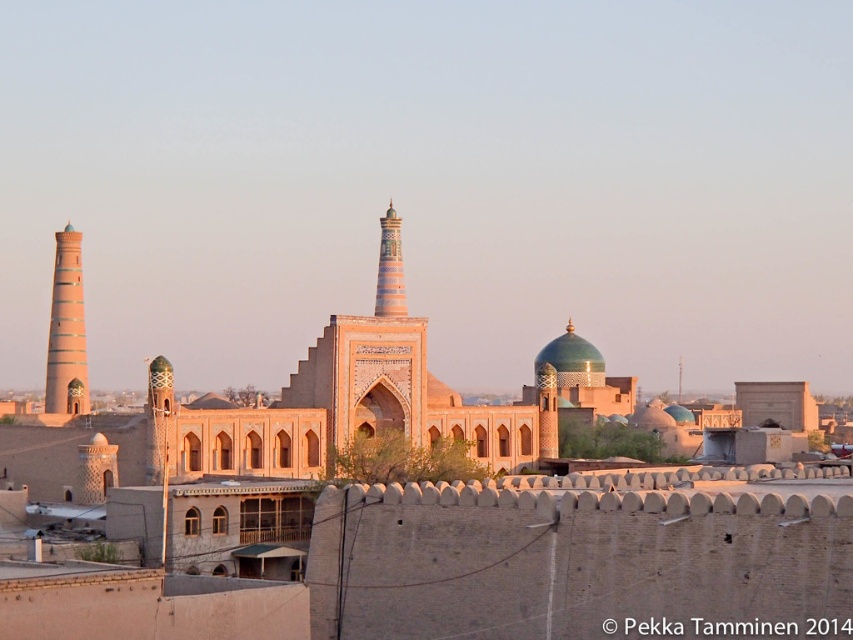
You are an architect visiting the historical site and need to take a photo of both the light brown clay tower at left and the multicolored ceramic minaret at center. Which object should you position to your left side in the camera frame to capture both in the same shot?

The light brown clay tower at left is positioned on the left side of the multicolored ceramic minaret at center. Therefore, to capture both in the same shot, you should position the light brown clay tower at left to your left side in the camera frame so that it aligns with the multicolored ceramic minaret at center on the right side.

You are an architect visiting the historical site and want to take a photo of the light brown clay tower at left and the multicolored ceramic minaret at center. From which side of the scene should you stand to ensure both structures are fully visible in your frame?

You should stand to the right side of the scene because the light brown clay tower at left is positioned under the multicolored ceramic minaret at center, so standing to the right would allow both structures to be visible without one blocking the other.

Based on the scene description, where is the light brown clay tower at left positioned in terms of coordinates?

The light brown clay tower at left is positioned at coordinates approximately 0.517 on the x axis and 0.079 on the y axis.